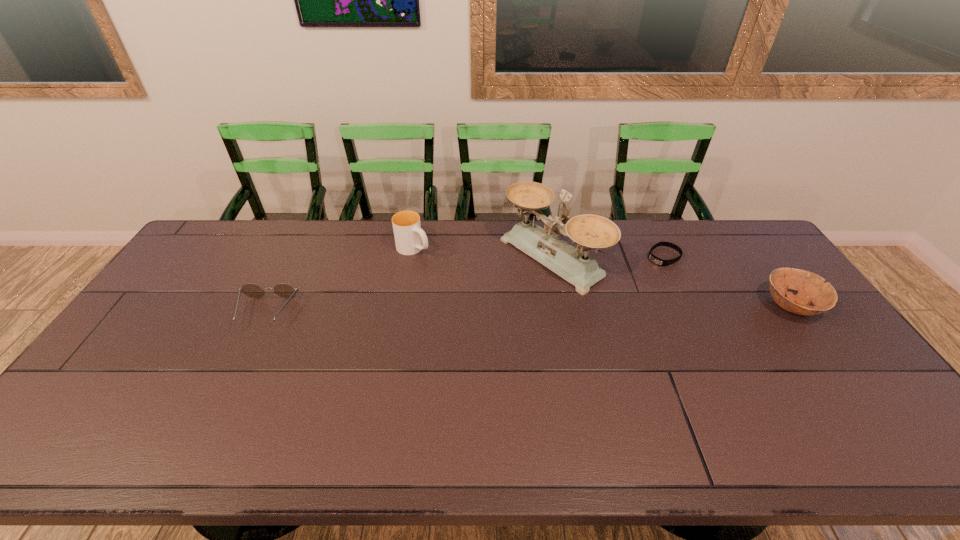
Image resolution: width=960 pixels, height=540 pixels. I want to click on the leftmost object, so click(283, 290).

This screenshot has width=960, height=540. I want to click on the fourth tallest object, so click(283, 290).

You are a GUI agent. You are given a task and a screenshot of the screen. Output one action in this format:
    pyautogui.click(x=<x>, y=<y>)
    Task: Click on the rightmost object
    
    Given the screenshot: What is the action you would take?
    pyautogui.click(x=811, y=288)

Find the location of a particular element. This screenshot has height=540, width=960. bowl is located at coordinates click(x=811, y=288).

Where is `the shortest object`? the shortest object is located at coordinates (653, 258).

Where is `the second object from right to left`? Image resolution: width=960 pixels, height=540 pixels. the second object from right to left is located at coordinates (653, 258).

You are a GUI agent. You are given a task and a screenshot of the screen. Output one action in this format:
    pyautogui.click(x=<x>, y=<y>)
    Task: Click on the second tallest object
    Image resolution: width=960 pixels, height=540 pixels.
    Given the screenshot: What is the action you would take?
    pyautogui.click(x=410, y=239)

Locate an element on the screen. the fourth object from right to left is located at coordinates (410, 239).

This screenshot has height=540, width=960. Find the location of `scale`. scale is located at coordinates (587, 231).

The width and height of the screenshot is (960, 540). What are the coordinates of `the third object from left to right` in the screenshot? It's located at (587, 231).